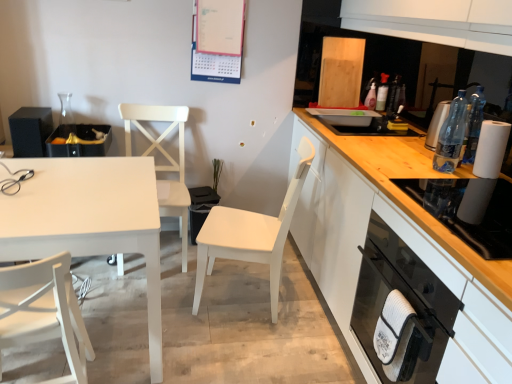
Question: Is clear plastic bottle at right, positioned as the 1th bottle in front-to-back order, closer to camera compared to black matte speaker at left, marked as the third appliance in a bottom-to-top arrangement?

Choices:
 (A) yes
 (B) no

Answer: (A)

Question: Is clear plastic bottle at right, positioned as the 1th bottle in front-to-back order, oriented towards black matte speaker at left, which ranks as the 1th appliance in left-to-right order?

Choices:
 (A) yes
 (B) no

Answer: (B)

Question: Can you confirm if clear plastic bottle at right, the 2th bottle from the back, is bigger than black matte speaker at left, marked as the third appliance in a bottom-to-top arrangement?

Choices:
 (A) no
 (B) yes

Answer: (A)

Question: Is clear plastic bottle at right, the second bottle in the top-to-bottom sequence, behind black matte speaker at left, which ranks as the 1th appliance in left-to-right order?

Choices:
 (A) yes
 (B) no

Answer: (B)

Question: From the image's perspective, is clear plastic bottle at right, positioned as the 1th bottle in front-to-back order, on top of black matte speaker at left, acting as the 1th appliance starting from the back?

Choices:
 (A) no
 (B) yes

Answer: (A)

Question: Is white matte chair at lower left, placed as the first chair when sorted from front to back, to the left or to the right of white paper at right in the image?

Choices:
 (A) right
 (B) left

Answer: (B)

Question: From the image's perspective, is white matte chair at lower left, marked as the third chair in a back-to-front arrangement, above or below white paper at right?

Choices:
 (A) below
 (B) above

Answer: (A)

Question: Considering their positions, is white matte chair at lower left, placed as the first chair when sorted from front to back, located in front of or behind white paper at right?

Choices:
 (A) front
 (B) behind

Answer: (A)

Question: Is white matte chair at lower left, placed as the first chair when sorted from front to back, inside or outside of white paper at right?

Choices:
 (A) inside
 (B) outside

Answer: (B)

Question: Considering their positions, is matte black trash bin at left, the second appliance viewed from the top, located in front of or behind black glass oven at lower right?

Choices:
 (A) behind
 (B) front

Answer: (A)

Question: From the image's perspective, relative to black glass oven at lower right, is matte black trash bin at left, the 2th appliance viewed from the front, above or below?

Choices:
 (A) above
 (B) below

Answer: (A)

Question: From a real-world perspective, relative to black glass oven at lower right, is matte black trash bin at left, the 2th appliance in the right-to-left sequence, vertically above or below?

Choices:
 (A) above
 (B) below

Answer: (A)

Question: Would you say matte black trash bin at left, the 2th appliance viewed from the front, is inside or outside black glass oven at lower right?

Choices:
 (A) outside
 (B) inside

Answer: (A)

Question: Is black matte speaker at left, marked as the third appliance in a bottom-to-top arrangement, bigger or smaller than translucent plastic bottle at upper right, arranged as the second bottle when ordered from the bottom?

Choices:
 (A) small
 (B) big

Answer: (B)

Question: In the image, is black matte speaker at left, which ranks as the 3th appliance in right-to-left order, positioned in front of or behind translucent plastic bottle at upper right, arranged as the second bottle when ordered from the bottom?

Choices:
 (A) front
 (B) behind

Answer: (A)